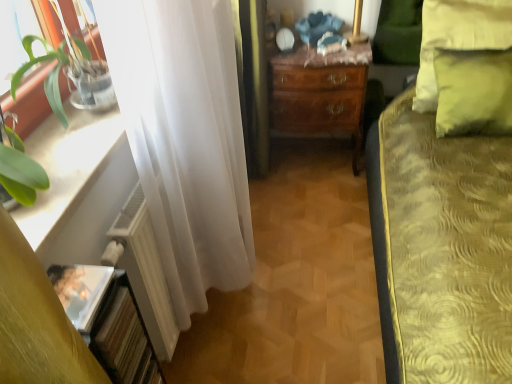
I want to click on vacant space situated above mahogany wooden desk at center (from a real-world perspective), so click(330, 55).